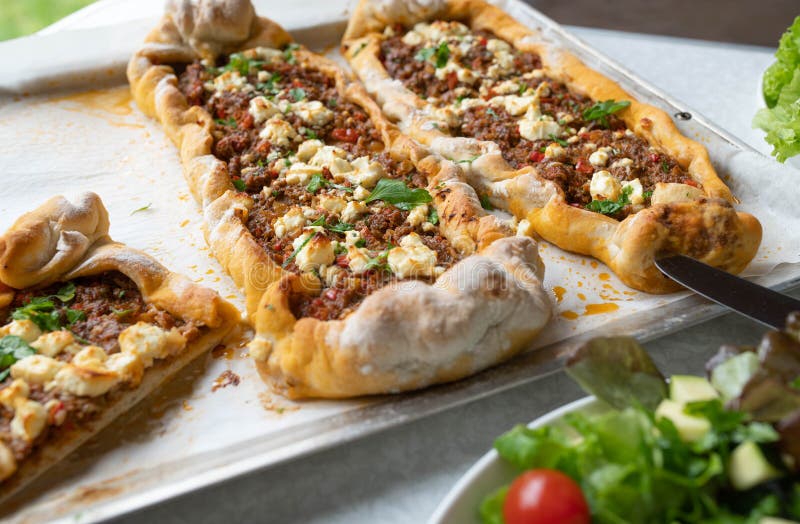
Find the location of a particular element. The height and width of the screenshot is (524, 800). plate is located at coordinates (478, 481).